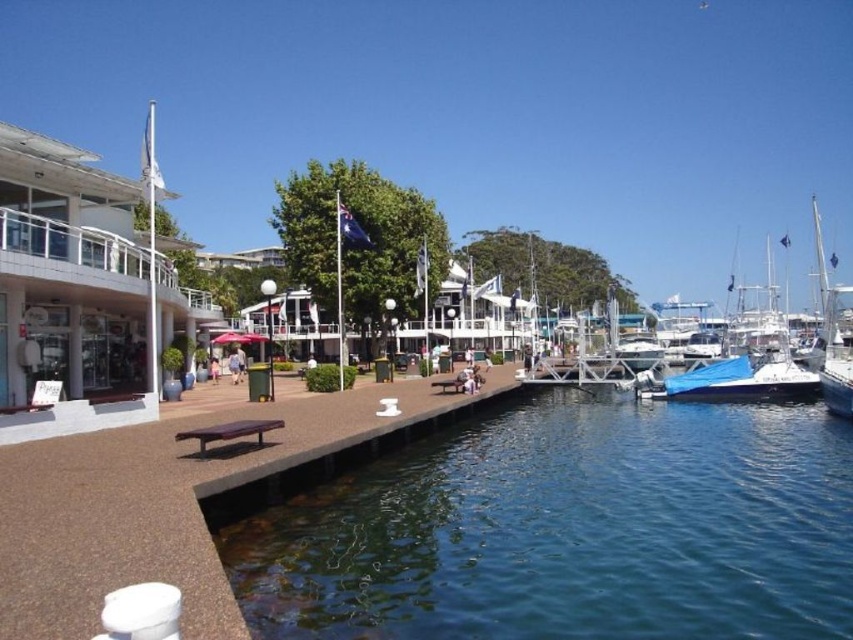
Question: Can you confirm if purple wood picnic table at lower left is thinner than brown wooden picnic table at center?

Choices:
 (A) yes
 (B) no

Answer: (B)

Question: Estimate the real-world distances between objects in this image. Which object is farther from the brown wood dock at center?

Choices:
 (A) blue tarpaulin boat at right
 (B) brown wooden picnic table at center
 (C) purple wood picnic table at lower left

Answer: (A)

Question: Does purple wood picnic table at lower left appear on the left side of brown wooden picnic table at center?

Choices:
 (A) no
 (B) yes

Answer: (B)

Question: Which object is farther from the camera taking this photo?

Choices:
 (A) brown wood dock at center
 (B) blue tarpaulin boat at right
 (C) brown wooden picnic table at center

Answer: (B)

Question: Among these objects, which one is nearest to the camera?

Choices:
 (A) brown wooden picnic table at center
 (B) purple wood picnic table at lower left
 (C) clear blue water at lower center
 (D) blue tarpaulin boat at right

Answer: (C)

Question: Is clear blue water at lower center thinner than brown wooden picnic table at center?

Choices:
 (A) no
 (B) yes

Answer: (A)